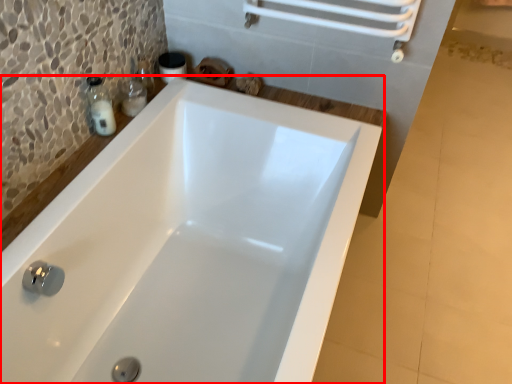
Question: From the image's perspective, where is bathtub (annotated by the red box) located in relation to soap dispenser in the image?

Choices:
 (A) below
 (B) above

Answer: (A)